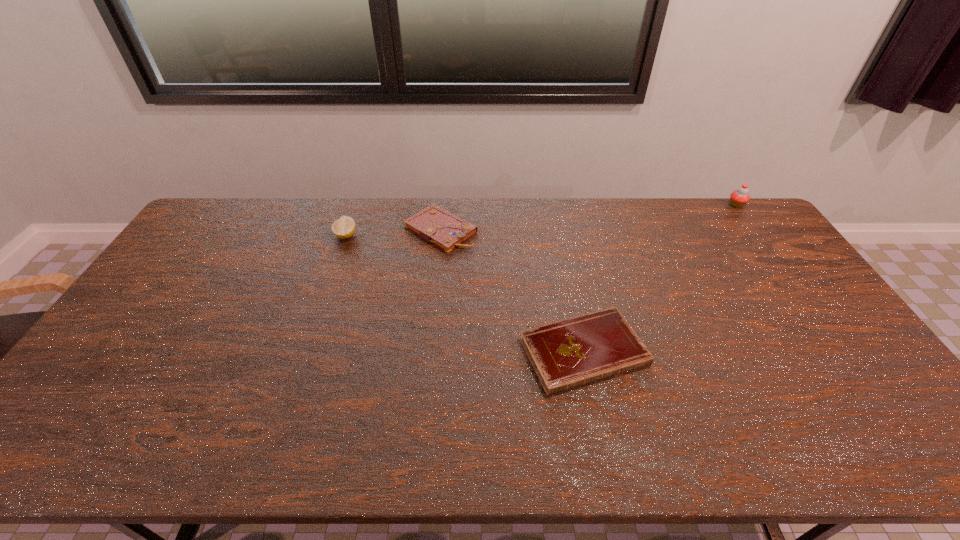
Identify the location of vacant space at the right edge of the desktop. Image resolution: width=960 pixels, height=540 pixels. (833, 336).

You are a GUI agent. You are given a task and a screenshot of the screen. Output one action in this format:
    pyautogui.click(x=<x>, y=<y>)
    Task: Click on the vacant space at the far left corner
    Image resolution: width=960 pixels, height=540 pixels.
    Given the screenshot: What is the action you would take?
    pyautogui.click(x=230, y=235)

In the image, there is a desktop. Where is `vacant space at the near right corner`? vacant space at the near right corner is located at coordinates (862, 441).

Where is `vacant area that lies between the third object from right to left and the lemon`? vacant area that lies between the third object from right to left and the lemon is located at coordinates (394, 233).

The width and height of the screenshot is (960, 540). Find the location of `free point between the third shortest object and the nearest object`. free point between the third shortest object and the nearest object is located at coordinates (465, 294).

The width and height of the screenshot is (960, 540). In order to click on free space between the second tallest object and the tallest object in this screenshot , I will do `click(541, 220)`.

The height and width of the screenshot is (540, 960). I want to click on vacant area that lies between the right notebook and the cupcake, so click(660, 278).

The height and width of the screenshot is (540, 960). What are the coordinates of `vacant area between the left notebook and the leftmost object` in the screenshot? It's located at (394, 233).

Locate an element on the screen. This screenshot has height=540, width=960. unoccupied position between the cupcake and the lemon is located at coordinates (541, 220).

I want to click on unoccupied position between the nearer notebook and the third tallest object, so click(x=513, y=291).